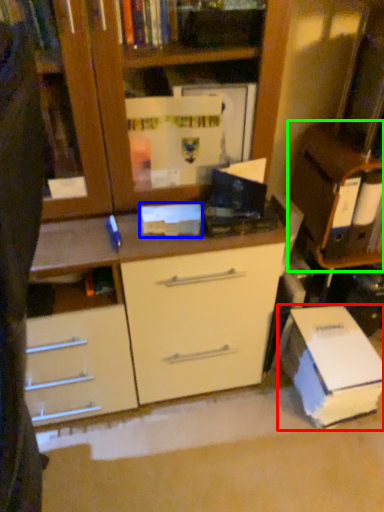
Question: Which object is the farthest from paperback book (highlighted by a red box)? Choose among these: paperback book (highlighted by a blue box) or cabinetry (highlighted by a green box).

Choices:
 (A) paperback book
 (B) cabinetry

Answer: (A)